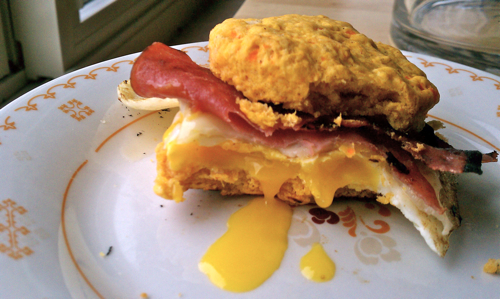
I want to click on glass, so click(x=451, y=20).